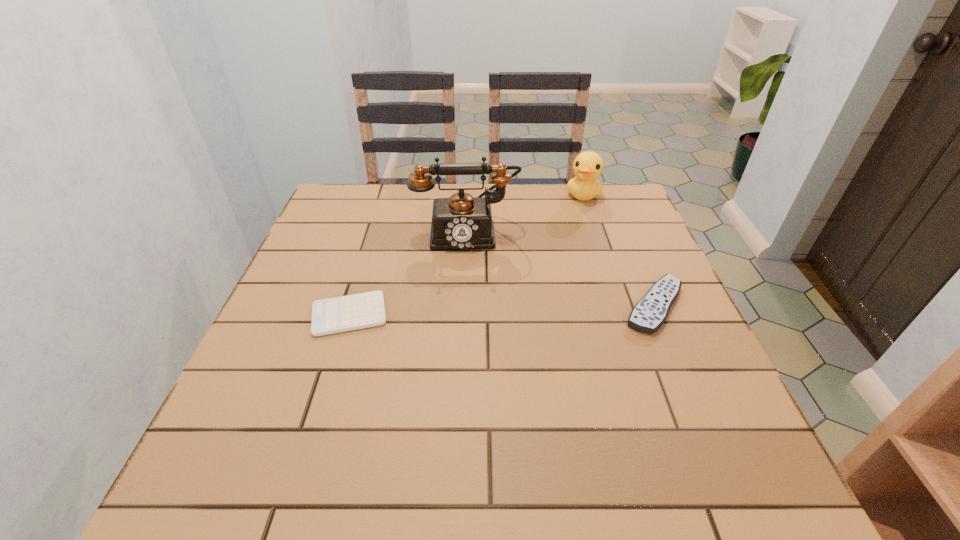
Find the location of `vacant space that satisfies the following two spatial constraints: 1. on the back side of the second tallest object; 2. on the right side of the leftmost object`. vacant space that satisfies the following two spatial constraints: 1. on the back side of the second tallest object; 2. on the right side of the leftmost object is located at coordinates (387, 195).